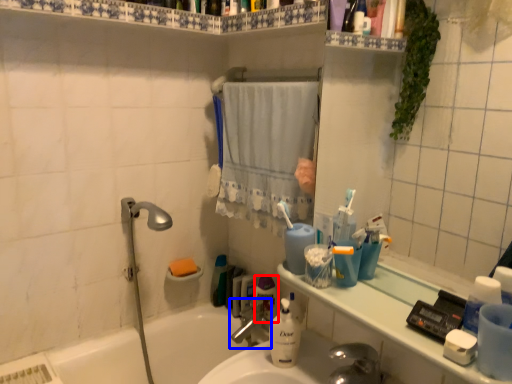
Question: Which object appears closest to the camera in this image, mouthwash (highlighted by a red box) or tap (highlighted by a blue box)?

Choices:
 (A) mouthwash
 (B) tap

Answer: (B)